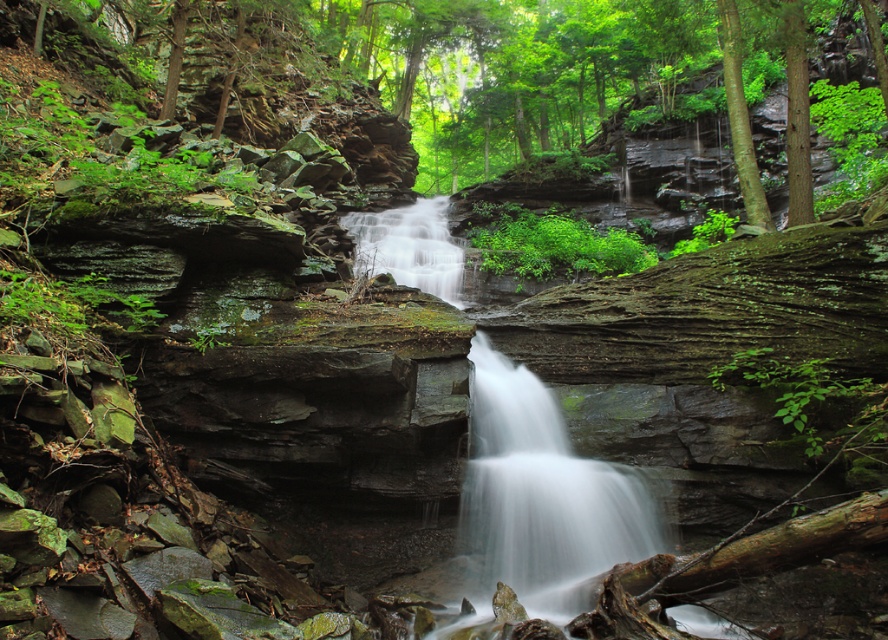
Question: Which of the following is the farthest from the observer?

Choices:
 (A) (541, 570)
 (B) (546, 458)

Answer: (B)

Question: Can you confirm if smooth gray rock waterfall at center is positioned to the left of white smooth water at center?

Choices:
 (A) no
 (B) yes

Answer: (B)

Question: From the image, what is the correct spatial relationship of smooth gray rock waterfall at center in relation to white smooth water at center?

Choices:
 (A) below
 (B) above

Answer: (B)

Question: Is smooth gray rock waterfall at center smaller than white smooth water at center?

Choices:
 (A) no
 (B) yes

Answer: (A)